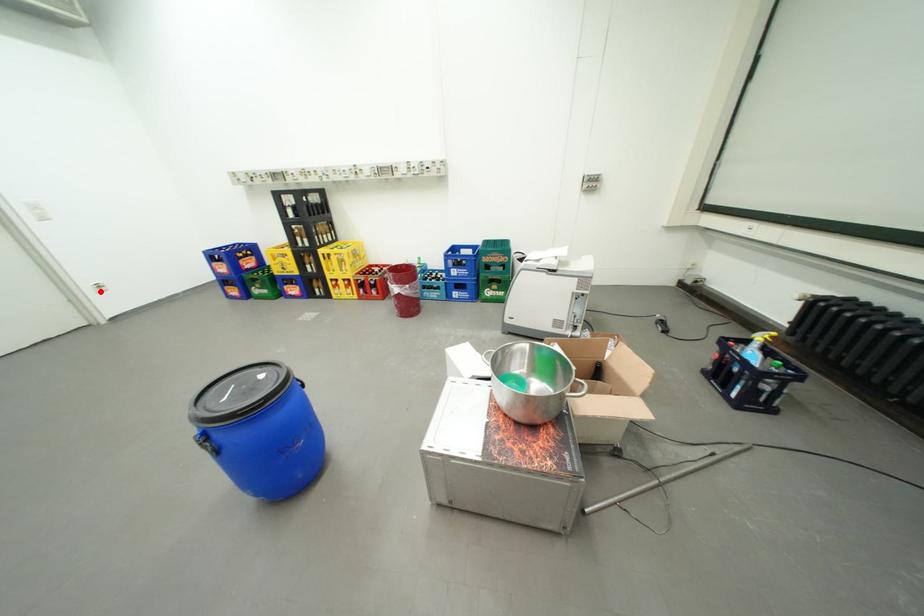
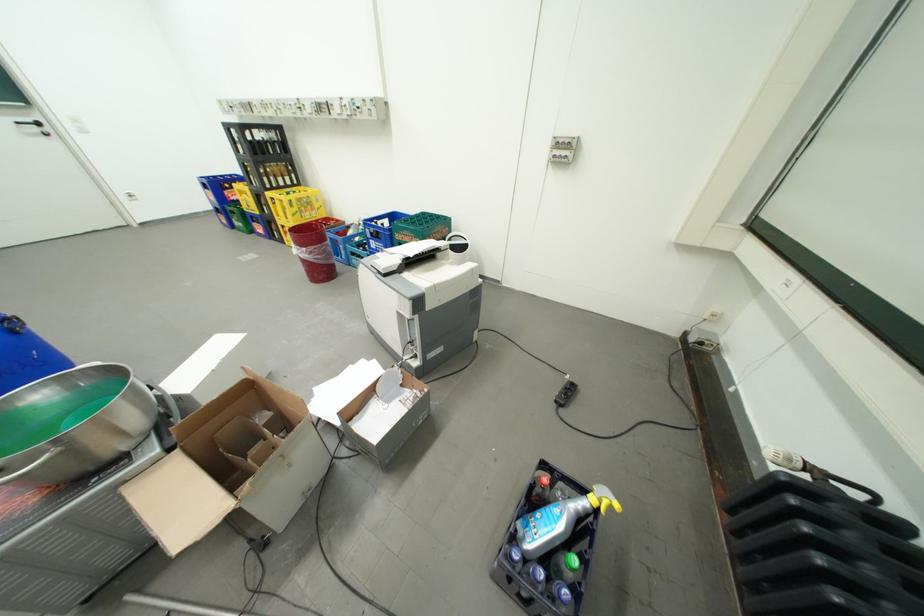
Question: I am providing you with two images of the same scene from different viewpoints. Given a red point in image1, look at the same physical point in image2. Is it:

Choices:
 (A) Closer to the viewpoint
 (B) Farther from the viewpoint

Answer: (B)